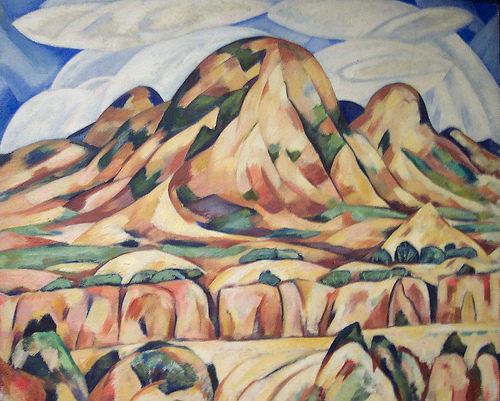
Locate an element on the screen. This screenshot has height=401, width=500. artwork is located at coordinates (299, 158).